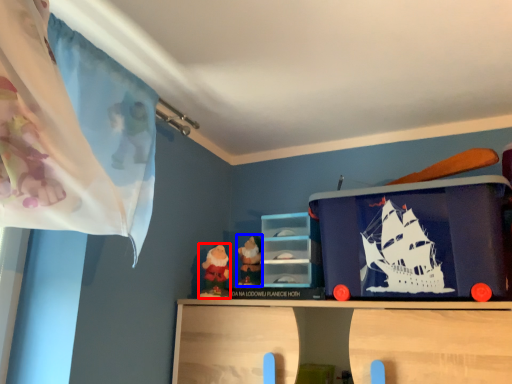
Question: Which object is closer to the camera taking this photo, toy (highlighted by a red box) or toy (highlighted by a blue box)?

Choices:
 (A) toy
 (B) toy

Answer: (A)